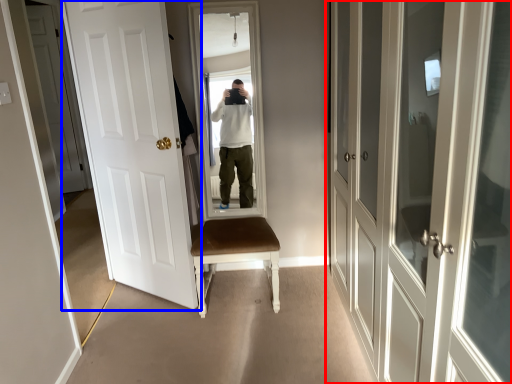
Question: Which point is closer to the camera, door (highlighted by a red box) or door (highlighted by a blue box)?

Choices:
 (A) door
 (B) door

Answer: (A)